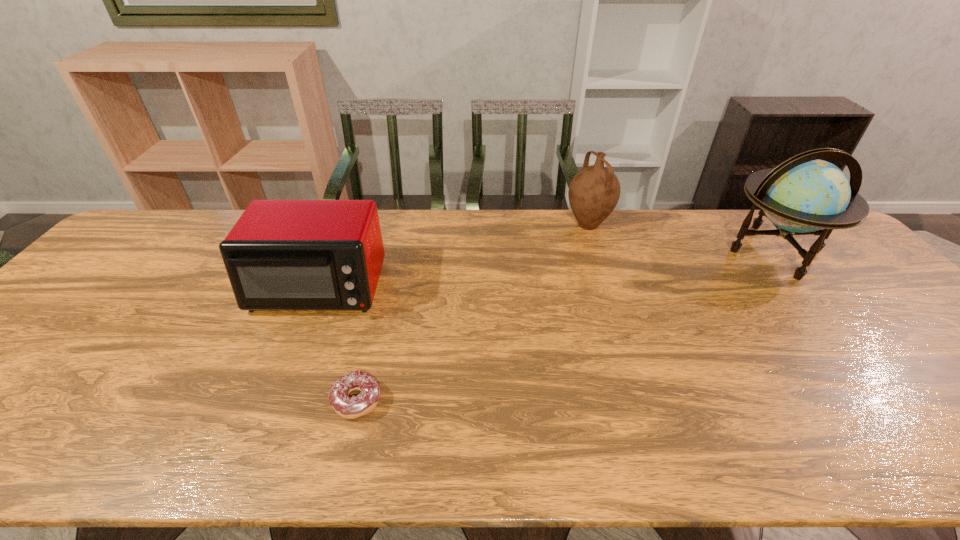
The width and height of the screenshot is (960, 540). Identify the location of object that is the closest one to the shortest object. (281, 254).

Where is `vacant space that satisfies the following two spatial constraints: 1. on the front-facing side of the third tallest object; 2. on the right side of the shortest object`? The height and width of the screenshot is (540, 960). vacant space that satisfies the following two spatial constraints: 1. on the front-facing side of the third tallest object; 2. on the right side of the shortest object is located at coordinates point(272,401).

This screenshot has width=960, height=540. I want to click on vacant region that satisfies the following two spatial constraints: 1. on the front-facing side of the toaster oven; 2. on the left side of the doughnut, so click(x=272, y=401).